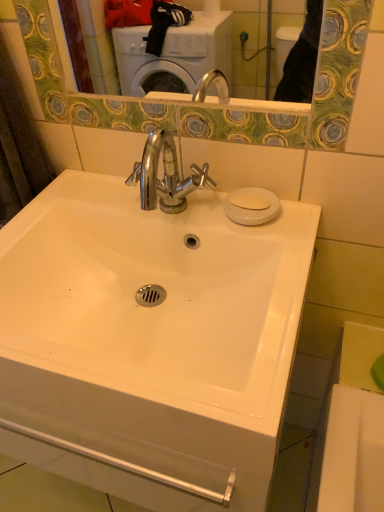
Image resolution: width=384 pixels, height=512 pixels. What do you see at coordinates (249, 199) in the screenshot? I see `white matte soap at upper right` at bounding box center [249, 199].

Identify the location of white matte soap at upper right. (249, 199).

Where is `white glossy sink at center`? The image size is (384, 512). white glossy sink at center is located at coordinates (149, 342).

The width and height of the screenshot is (384, 512). Describe the element at coordinates (149, 342) in the screenshot. I see `white glossy sink at center` at that location.

You are a GUI agent. You are given a task and a screenshot of the screen. Output one action in this format:
    pyautogui.click(x=<x>, y=<y>)
    Task: Click on the white matte soap at upper right
    The width and height of the screenshot is (384, 512).
    Given the screenshot: What is the action you would take?
    tap(249, 199)

Considering the positions of objects white matte soap at upper right and white glossy sink at center in the image provided, who is more to the right, white matte soap at upper right or white glossy sink at center?

white matte soap at upper right.

Is white matte soap at upper right further to camera compared to white glossy sink at center?

Yes, it is behind white glossy sink at center.

Is point (254, 193) positioned behind point (84, 237)?

That is False.

From the image's perspective, would you say white matte soap at upper right is positioned over white glossy sink at center?

A: Yes, from the image's perspective, white matte soap at upper right is above white glossy sink at center.

From a real-world perspective, between white matte soap at upper right and white glossy sink at center, who is vertically higher?

white matte soap at upper right.

Considering the sizes of white matte soap at upper right and white glossy sink at center in the image, is white matte soap at upper right wider or thinner than white glossy sink at center?

Clearly, white matte soap at upper right has less width compared to white glossy sink at center.

From their relative heights in the image, would you say white matte soap at upper right is taller or shorter than white glossy sink at center?

Clearly, white matte soap at upper right is shorter compared to white glossy sink at center.

Is white matte soap at upper right smaller than white glossy sink at center?

Yes.

Can we say white matte soap at upper right lies outside white glossy sink at center?

Indeed, white matte soap at upper right is completely outside white glossy sink at center.

Is white matte soap at upper right placed right next to white glossy sink at center?

They are not placed beside each other.

Is white matte soap at upper right turned away from white glossy sink at center?

No, white matte soap at upper right is not facing the opposite direction of white glossy sink at center.

Measure the distance from white matte soap at upper right to white glossy sink at center.

14.29 inches.

At what (x,y) coordinates should I click in order to perform the action: click on sink in front of the white matte soap at upper right. Please return your answer as a coordinate pair (x, y). This screenshot has width=384, height=512. Looking at the image, I should click on (149, 342).

From the picture: Which is more to the right, white glossy sink at center or white matte soap at upper right?

From the viewer's perspective, white matte soap at upper right appears more on the right side.

Is white glossy sink at center positioned in front of white matte soap at upper right?

Yes, white glossy sink at center is in front of white matte soap at upper right.

Considering the positions of points (115, 435) and (238, 194), is point (115, 435) farther from camera compared to point (238, 194)?

No, (115, 435) is closer to viewer.

From the image's perspective, between white glossy sink at center and white matte soap at upper right, who is located below?

white glossy sink at center appears lower in the image.

From a real-world perspective, is white glossy sink at center above or below white matte soap at upper right?

white glossy sink at center is below white matte soap at upper right.

In the scene shown: Is white glossy sink at center wider than white matte soap at upper right?

Yes, white glossy sink at center is wider than white matte soap at upper right.

Who is shorter, white glossy sink at center or white matte soap at upper right?

With less height is white matte soap at upper right.

Which of these two, white glossy sink at center or white matte soap at upper right, is bigger?

Bigger between the two is white glossy sink at center.

Choose the correct answer: Is white glossy sink at center inside white matte soap at upper right or outside it?

white glossy sink at center exists outside the volume of white matte soap at upper right.

Are white glossy sink at center and white matte soap at upper right far apart?

No.

Is white glossy sink at center oriented towards white matte soap at upper right?

No.

What's the angular difference between white glossy sink at center and white matte soap at upper right's facing directions?

1.83e-05 degrees.

Identify the location of sink in front of the white matte soap at upper right. (149, 342).

Find the location of `soap that is on the right side of white glossy sink at center`. soap that is on the right side of white glossy sink at center is located at coordinates (249, 199).

Where is `sink located underneath the white matte soap at upper right (from a real-world perspective)`? The width and height of the screenshot is (384, 512). sink located underneath the white matte soap at upper right (from a real-world perspective) is located at coordinates (149, 342).